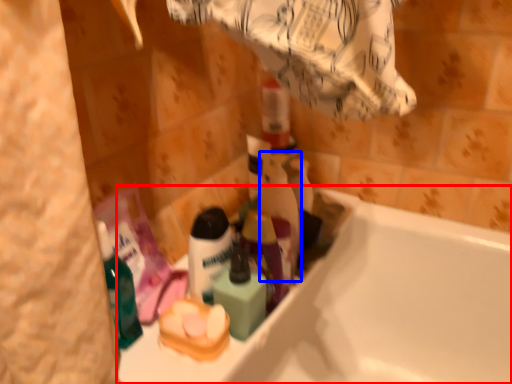
Question: Which point is closer to the camera, bathtub (highlighted by a red box) or cleaning product (highlighted by a blue box)?

Choices:
 (A) bathtub
 (B) cleaning product

Answer: (A)